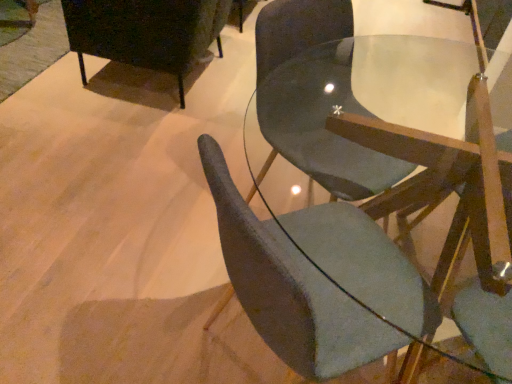
Question: Considering the relative sizes of matte black cabinet at upper left, the third chair when ordered from right to left, and matte gray chair at center, the 2th chair in the left-to-right sequence, in the image provided, is matte black cabinet at upper left, the third chair when ordered from right to left, bigger than matte gray chair at center, the 2th chair in the left-to-right sequence,?

Choices:
 (A) no
 (B) yes

Answer: (B)

Question: Is matte gray chair at center, the 2th chair in the left-to-right sequence, a part of matte black cabinet at upper left, the third chair when ordered from right to left?

Choices:
 (A) yes
 (B) no

Answer: (B)

Question: Considering the relative positions of matte black cabinet at upper left, which is the first chair from left to right, and matte gray chair at center, the 2th chair positioned from the right, in the image provided, is matte black cabinet at upper left, which is the first chair from left to right, behind matte gray chair at center, the 2th chair positioned from the right,?

Choices:
 (A) no
 (B) yes

Answer: (B)

Question: Is matte black cabinet at upper left, the third chair when ordered from right to left, in contact with matte gray chair at center, the 2th chair positioned from the right?

Choices:
 (A) yes
 (B) no

Answer: (B)

Question: Could you tell me if matte black cabinet at upper left, which is the first chair from left to right, is turned towards matte gray chair at center, the 2th chair in the left-to-right sequence?

Choices:
 (A) yes
 (B) no

Answer: (B)

Question: From a real-world perspective, is matte black cabinet at upper left, which is the first chair from left to right, physically below matte gray chair at center, the 2th chair in the left-to-right sequence?

Choices:
 (A) yes
 (B) no

Answer: (A)

Question: Is matte gray chair at center, placed as the third chair when sorted from left to right, wider than matte gray chair at center, the 2th chair in the left-to-right sequence?

Choices:
 (A) yes
 (B) no

Answer: (A)

Question: Can you confirm if matte gray chair at center, acting as the first chair starting from the right, is shorter than matte gray chair at center, the 2th chair positioned from the right?

Choices:
 (A) yes
 (B) no

Answer: (A)

Question: From a real-world perspective, is matte gray chair at center, acting as the first chair starting from the right, over matte gray chair at center, the 2th chair positioned from the right?

Choices:
 (A) yes
 (B) no

Answer: (B)

Question: Does matte gray chair at center, placed as the third chair when sorted from left to right, appear on the right side of matte gray chair at center, the 2th chair positioned from the right?

Choices:
 (A) no
 (B) yes

Answer: (B)

Question: Is matte gray chair at center, acting as the first chair starting from the right, not inside matte gray chair at center, the 2th chair positioned from the right?

Choices:
 (A) yes
 (B) no

Answer: (A)

Question: Is matte gray chair at center, placed as the third chair when sorted from left to right, next to matte gray chair at center, the 2th chair positioned from the right, and touching it?

Choices:
 (A) yes
 (B) no

Answer: (B)

Question: Is matte black cabinet at upper left, the third chair when ordered from right to left, to the right of matte gray chair at center, acting as the first chair starting from the right, from the viewer's perspective?

Choices:
 (A) yes
 (B) no

Answer: (B)